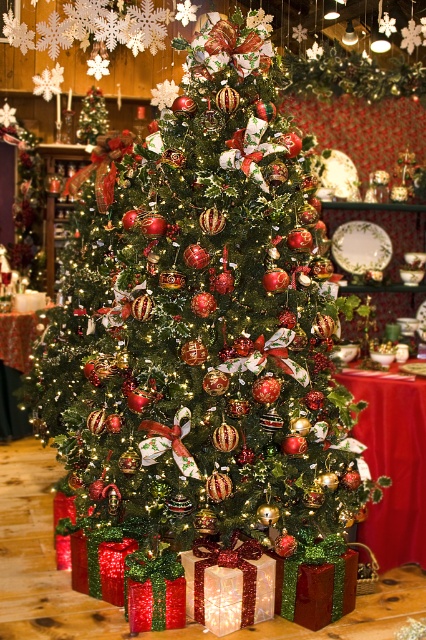
Question: Does shiny metallic ornaments at center have a larger size compared to red cloth table at center?

Choices:
 (A) no
 (B) yes

Answer: (B)

Question: Among these points, which one is nearest to the camera?

Choices:
 (A) (137, 522)
 (B) (417, 472)

Answer: (A)

Question: Is shiny metallic ornaments at center to the left of red cloth table at center from the viewer's perspective?

Choices:
 (A) yes
 (B) no

Answer: (A)

Question: Which point is farther to the camera?

Choices:
 (A) red cloth table at center
 (B) shiny metallic ornaments at center

Answer: (A)

Question: Does shiny metallic ornaments at center have a smaller size compared to red cloth table at center?

Choices:
 (A) no
 (B) yes

Answer: (A)

Question: Which point is farther from the camera taking this photo?

Choices:
 (A) (393, 416)
 (B) (147, 307)

Answer: (A)